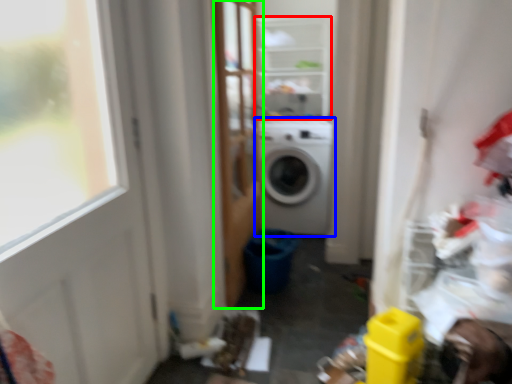
Question: Based on their relative distances, which object is farther from shelf (highlighted by a red box)? Choose from washing machine (highlighted by a blue box) and screen door (highlighted by a green box).

Choices:
 (A) washing machine
 (B) screen door

Answer: (A)